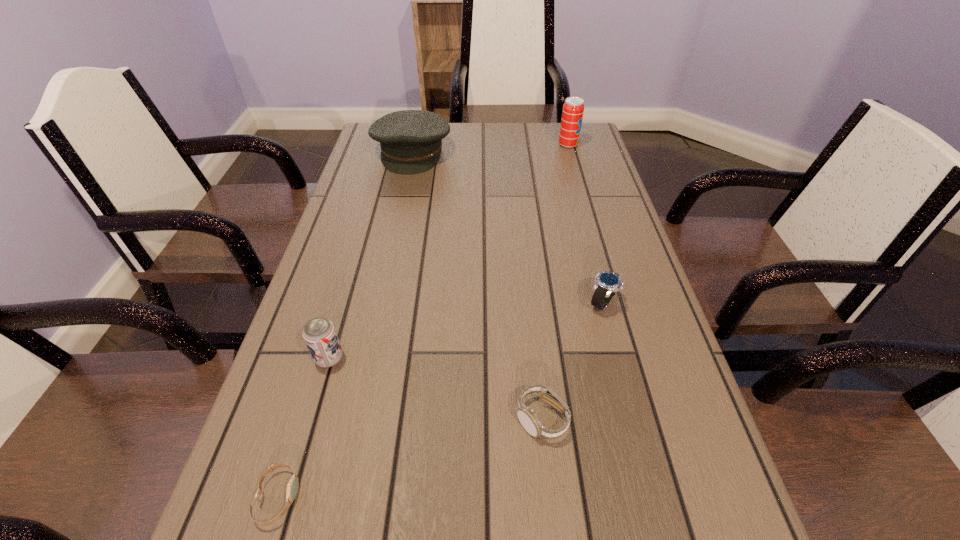
The height and width of the screenshot is (540, 960). What are the coordinates of `the tallest object` in the screenshot? It's located at (573, 109).

Find the location of `the second tallest object`. the second tallest object is located at coordinates (411, 140).

Locate an element on the screen. the fourth farthest object is located at coordinates (319, 333).

Find the location of a particular element. This screenshot has height=540, width=960. the fourth shortest object is located at coordinates (319, 333).

This screenshot has width=960, height=540. Identify the location of the fourth nearest object. (607, 283).

I want to click on the tallest watch, so click(x=607, y=283).

At what (x,y) coordinates should I click in order to perform the action: click on the second watch from right to left. Please return your answer as a coordinate pair (x, y). The height and width of the screenshot is (540, 960). Looking at the image, I should click on (527, 417).

What are the coordinates of `the fifth farthest object` in the screenshot? It's located at (527, 417).

This screenshot has height=540, width=960. Find the location of `the nearest watch`. the nearest watch is located at coordinates (292, 487).

The image size is (960, 540). Find the location of `the nearest object`. the nearest object is located at coordinates (292, 487).